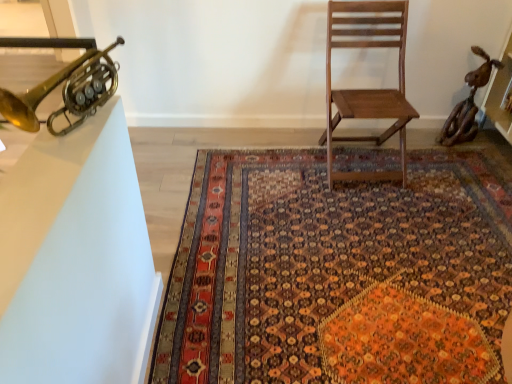
Question: From the image's perspective, is gold brass trumpet at upper left on top of white glossy table at left?

Choices:
 (A) no
 (B) yes

Answer: (B)

Question: Is gold brass trumpet at upper left positioned behind white glossy table at left?

Choices:
 (A) no
 (B) yes

Answer: (B)

Question: Is gold brass trumpet at upper left located outside white glossy table at left?

Choices:
 (A) no
 (B) yes

Answer: (B)

Question: Considering the relative positions of gold brass trumpet at upper left and white glossy table at left in the image provided, is gold brass trumpet at upper left to the right of white glossy table at left from the viewer's perspective?

Choices:
 (A) no
 (B) yes

Answer: (A)

Question: Is the depth of gold brass trumpet at upper left less than that of white glossy table at left?

Choices:
 (A) no
 (B) yes

Answer: (A)

Question: Is gold brass trumpet at upper left oriented towards white glossy table at left?

Choices:
 (A) no
 (B) yes

Answer: (A)

Question: Is wooden chair at center bigger than white glossy table at left?

Choices:
 (A) no
 (B) yes

Answer: (B)

Question: From a real-world perspective, is wooden chair at center over white glossy table at left?

Choices:
 (A) yes
 (B) no

Answer: (B)

Question: Considering the relative positions of wooden chair at center and white glossy table at left in the image provided, is wooden chair at center behind white glossy table at left?

Choices:
 (A) yes
 (B) no

Answer: (A)

Question: Does wooden chair at center have a lesser width compared to white glossy table at left?

Choices:
 (A) no
 (B) yes

Answer: (A)

Question: Is wooden chair at center surrounding white glossy table at left?

Choices:
 (A) yes
 (B) no

Answer: (B)

Question: Does wooden chair at center have a lesser height compared to white glossy table at left?

Choices:
 (A) yes
 (B) no

Answer: (B)

Question: Can you confirm if white glossy table at left is smaller than carpet with intricate patterns at center?

Choices:
 (A) yes
 (B) no

Answer: (A)